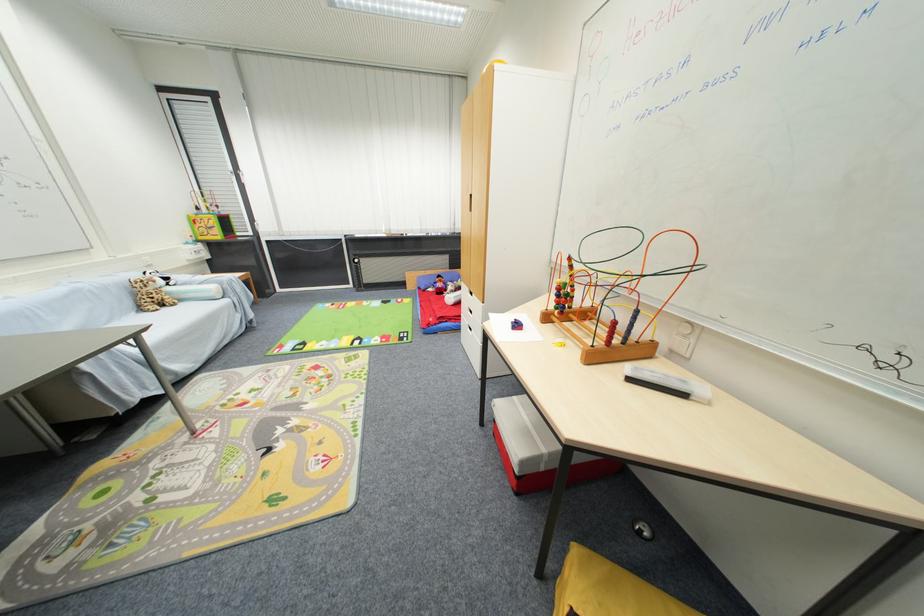
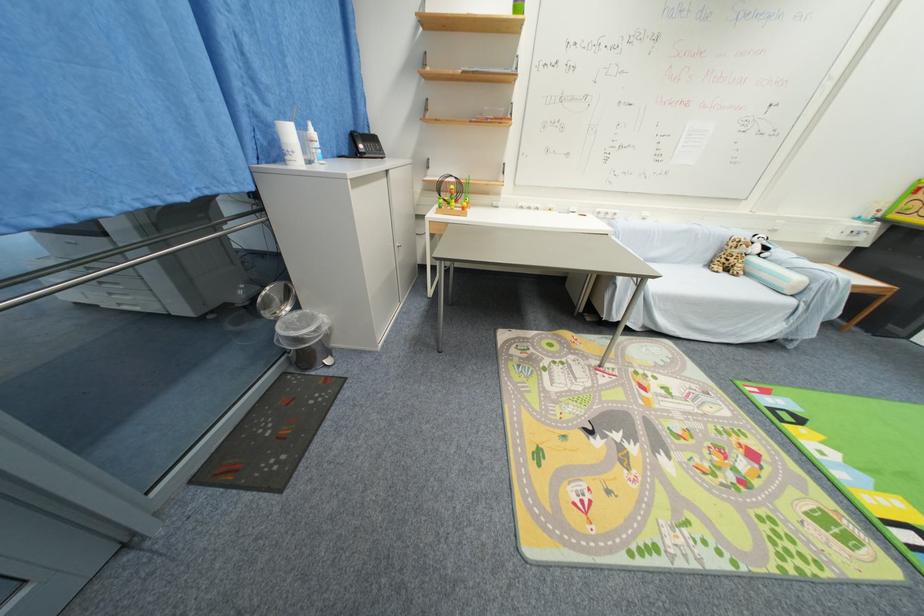
How did the camera likely rotate?

The rotation direction of the camera is left-down.